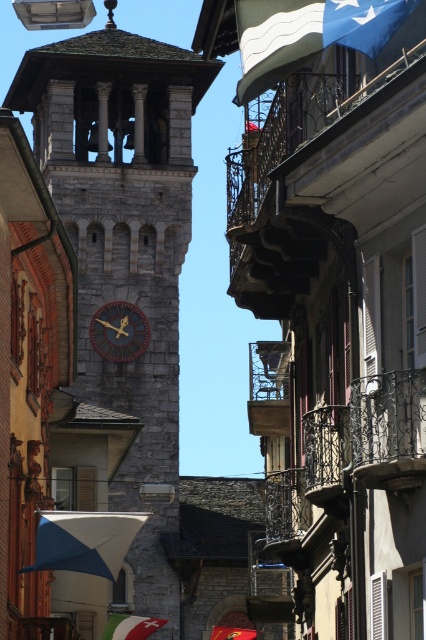
Who is higher up, blue fabric flag at upper right or blue fabric umbrella at center?

blue fabric flag at upper right is higher up.

Does point (339, 17) come in front of point (118, 516)?

Yes, point (339, 17) is in front of point (118, 516).

The width and height of the screenshot is (426, 640). I want to click on blue fabric flag at upper right, so click(x=307, y=33).

Between point (241, 58) and point (121, 332), which one is positioned behind?

Point (121, 332)

Does blue fabric flag at upper right appear over wooden clock at center?

Yes.

Between point (268, 1) and point (103, 340), which one is positioned behind?

Positioned behind is point (103, 340).

Where is `blue fabric flag at upper right`? This screenshot has width=426, height=640. blue fabric flag at upper right is located at coordinates (307, 33).

Looking at this image, does wooden clock at center have a greater width compared to blue fabric flag at upper center?

Correct, the width of wooden clock at center exceeds that of blue fabric flag at upper center.

Does point (115, 356) come farther from viewer compared to point (247, 637)?

Yes, point (115, 356) is behind point (247, 637).

Who is more distant from viewer, (109, 323) or (238, 634)?

The point (109, 323) is behind.

You are a GUI agent. You are given a task and a screenshot of the screen. Output one action in this format:
    pyautogui.click(x=<x>, y=<y>)
    Task: Click on the wooden clock at center
    Image resolution: width=426 pixels, height=640 pixels.
    Given the screenshot: What is the action you would take?
    pyautogui.click(x=118, y=332)